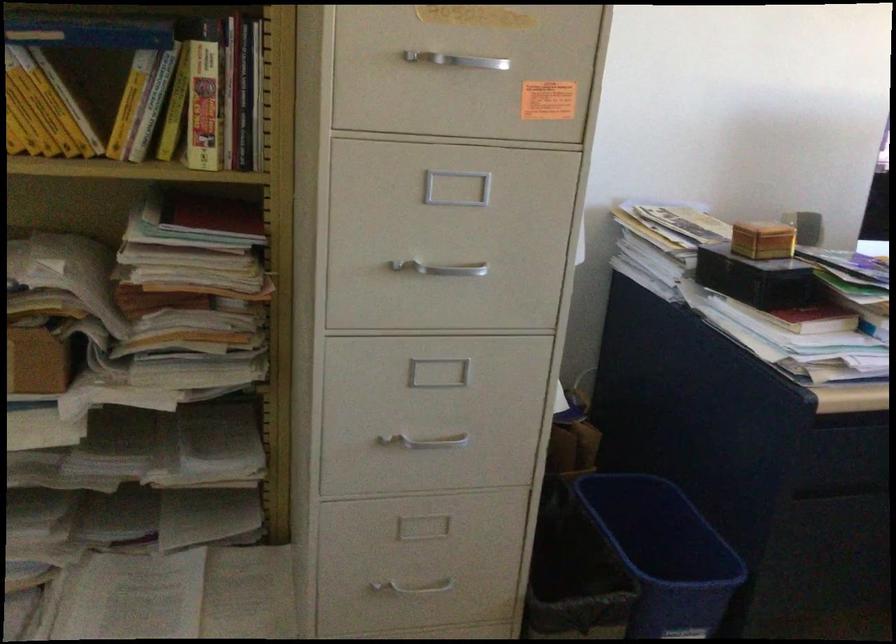
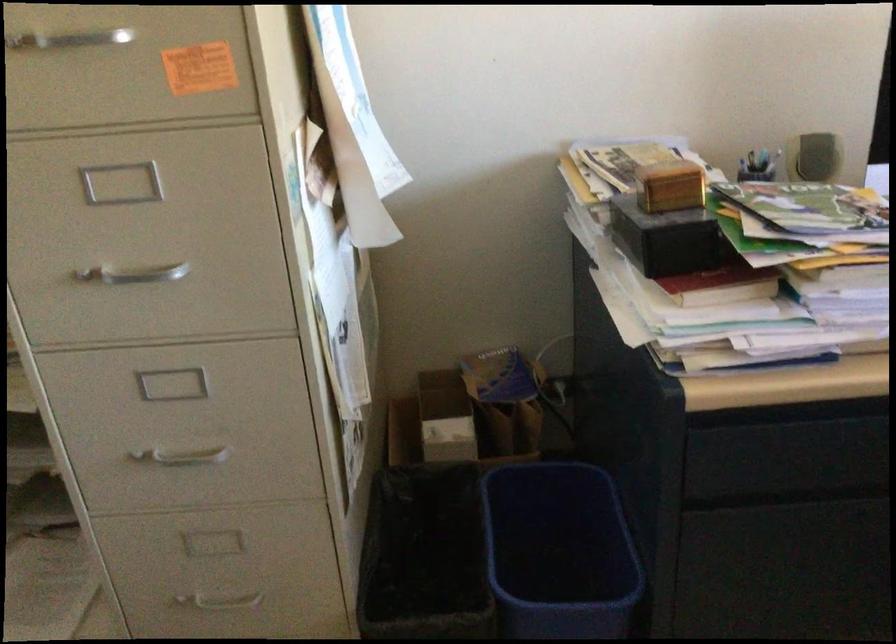
Question: The images are taken continuously from a first-person perspective. In which direction is your viewpoint rotating?

Choices:
 (A) Left
 (B) Right
 (C) Up
 (D) Down

Answer: (A)